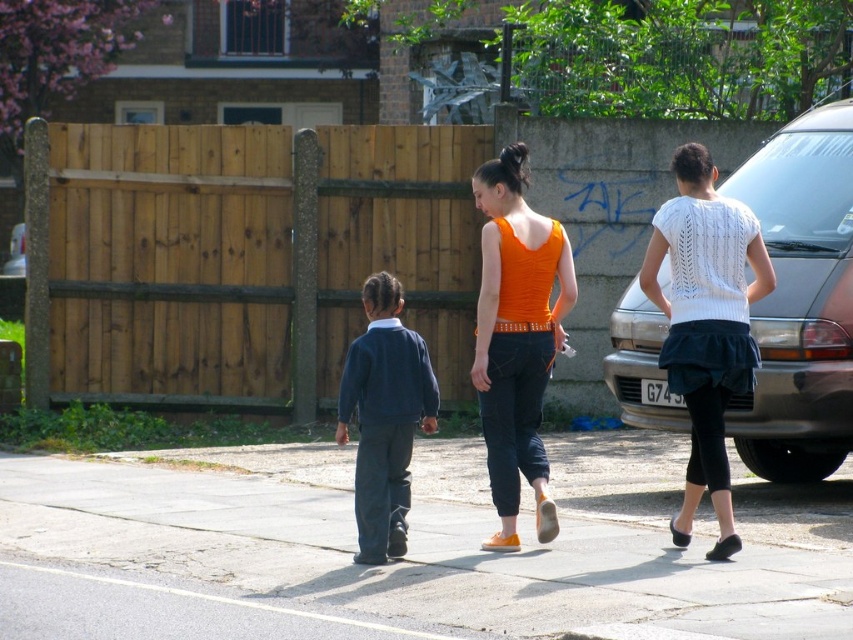
Question: Observing the image, what is the correct spatial positioning of gray concrete sidewalk at center in reference to white knitted sweater at upper right?

Choices:
 (A) above
 (B) below

Answer: (B)

Question: Which object appears closest to the camera in this image?

Choices:
 (A) gray concrete sidewalk at center
 (B) orange matte tank top at center

Answer: (A)

Question: Is gray concrete sidewalk at center below navy blue sweater at center?

Choices:
 (A) yes
 (B) no

Answer: (A)

Question: Among these objects, which one is nearest to the camera?

Choices:
 (A) white knitted sweater at upper right
 (B) gray concrete sidewalk at center
 (C) navy blue sweater at center
 (D) metallic gray car at right

Answer: (B)

Question: Does gray concrete sidewalk at center appear under navy blue sweater at center?

Choices:
 (A) yes
 (B) no

Answer: (A)

Question: Which object is closer to the camera taking this photo?

Choices:
 (A) white knitted sweater at upper right
 (B) metallic gray car at right

Answer: (A)